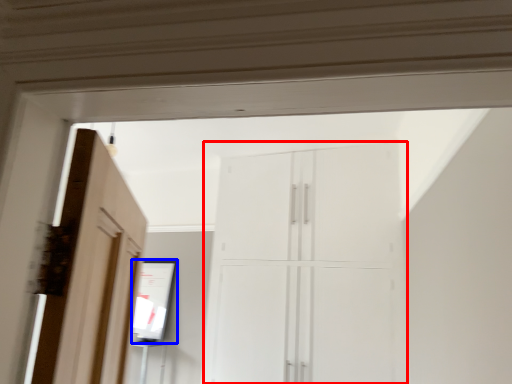
Question: Which point is closer to the camera, cupboard (highlighted by a red box) or mirror (highlighted by a blue box)?

Choices:
 (A) cupboard
 (B) mirror

Answer: (A)